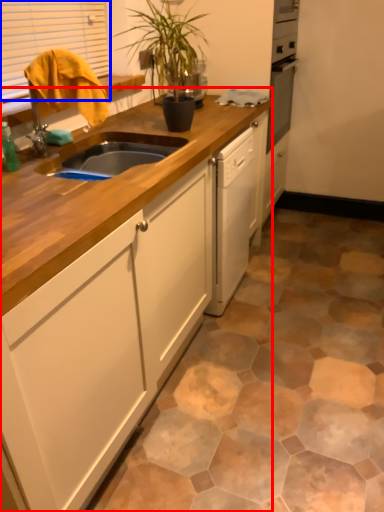
Question: Among these objects, which one is farthest to the camera, cabinetry (highlighted by a red box) or window (highlighted by a blue box)?

Choices:
 (A) cabinetry
 (B) window

Answer: (B)